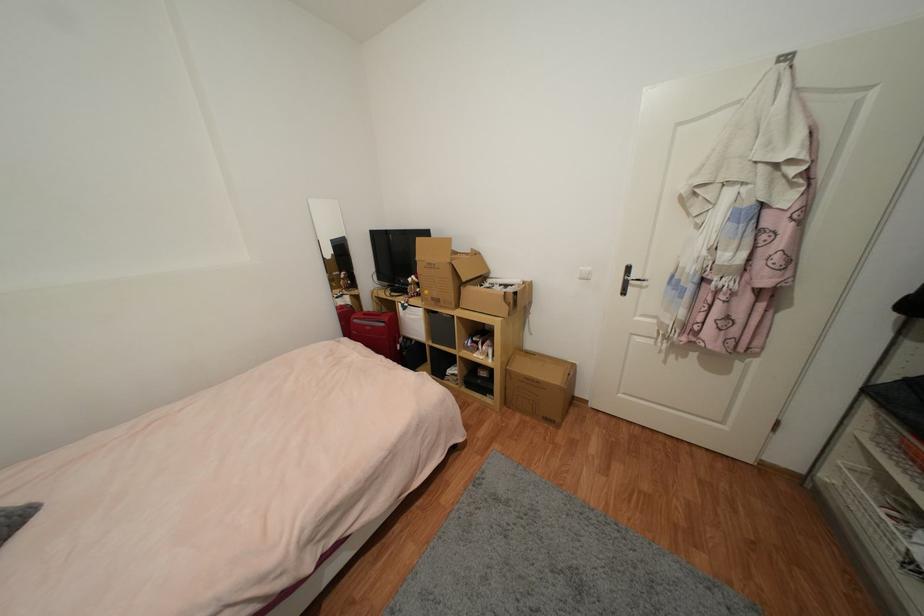
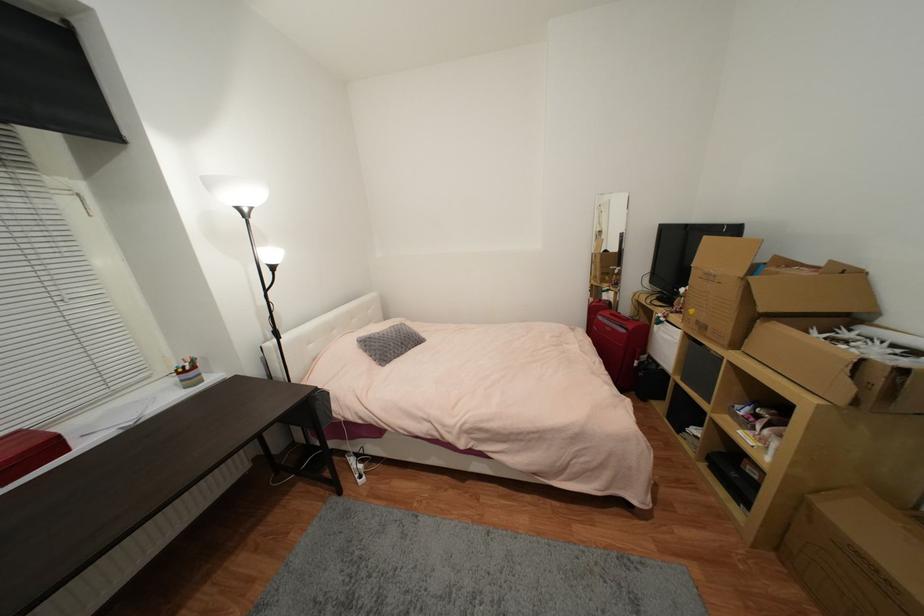
Find the pixel in the second image that matches point (509, 403) in the first image.

(782, 546)